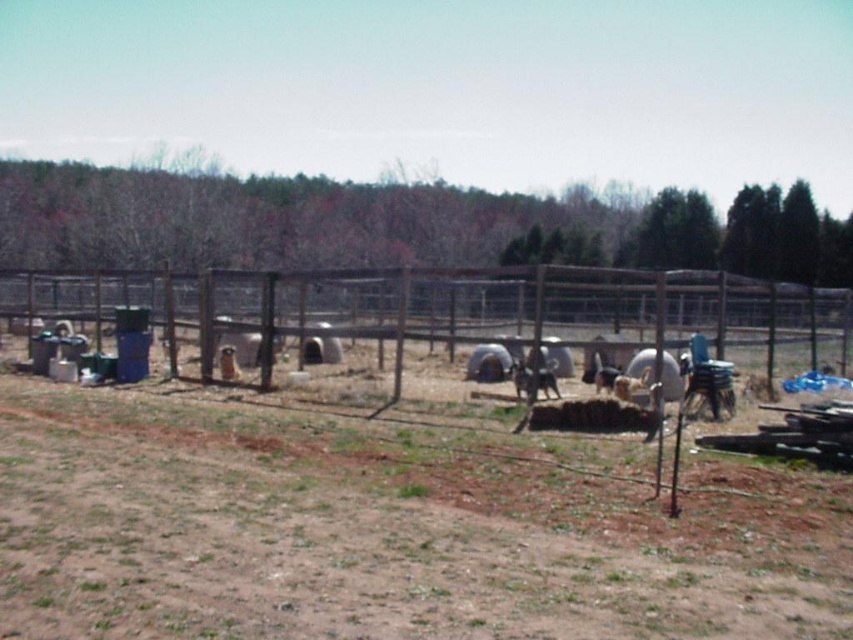
You are standing in the fenced area and want to walk to the brown wire fence at center. Which direction should you move relative to the brown dirt field at lower center?

You should move to the right relative to the brown dirt field at lower center because the brown wire fence at center is to the right of the brown dirt field at lower center.

You are a farmer checking the enclosure for potential hazards. You notice the brown dirt field at lower center and the brown wire fence at center. Which object is shorter in height?

The brown dirt field at lower center is not as tall as the brown wire fence at center, so the dirt field is shorter in height.

You are standing at the entrance of the fenced area and see the point marked as point (374, 538). What type of terrain is located at that point?

The point (374, 538) corresponds to the brown dirt field at lower center.